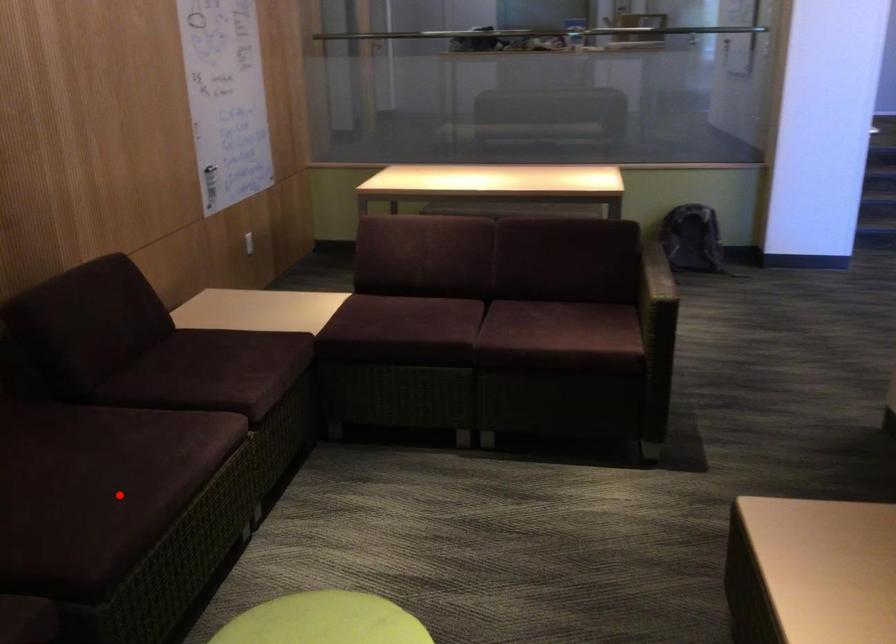
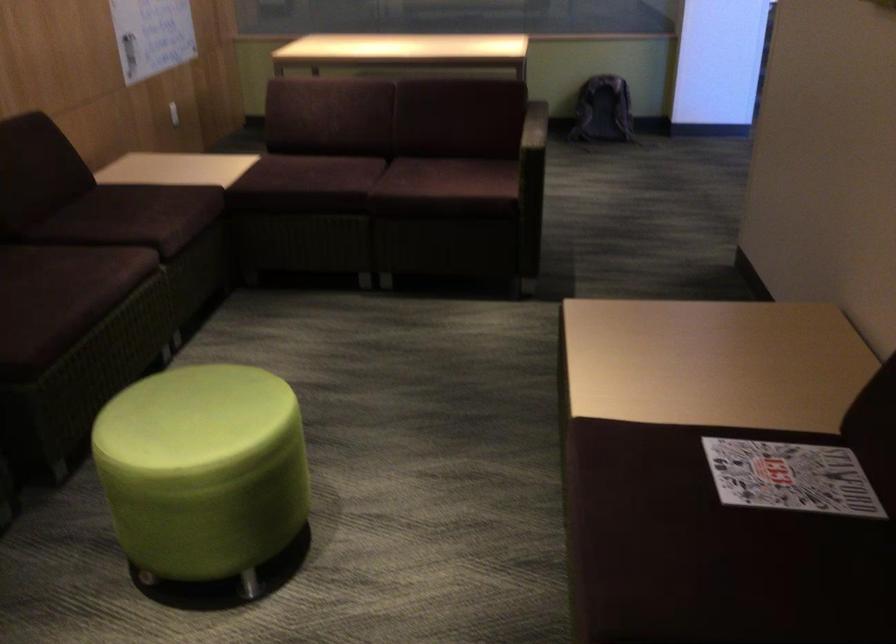
The point at the highlighted location is marked in the first image. Where is the corresponding point in the second image?

(44, 301)